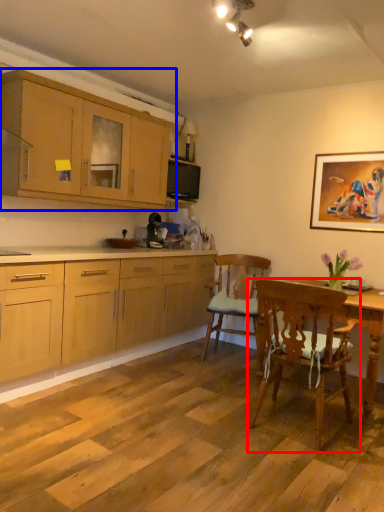
Question: Which point is closer to the camera, chair (highlighted by a red box) or cabinetry (highlighted by a blue box)?

Choices:
 (A) chair
 (B) cabinetry

Answer: (A)